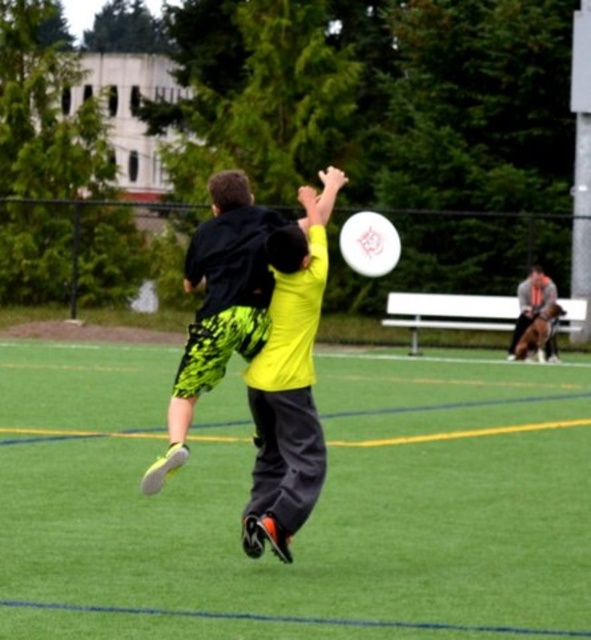
You are a photographer standing at the center of the field trying to capture the perfect shot of the two players in midair. You notice two points marked on your camera screen at coordinates point (368,241) and point (537,301). Which point is closer to your camera lens?

Point (537,301) is closer to the camera lens because the Objects Description states that point (368,241) is further to the camera than point (537,301).

You are a referee observing the game. You need to determine if the neon green shorts at center is closer to the white matte frisbee at center than the other player. Can you confirm this?

The neon green shorts at center is in front of the white matte frisbee at center, so yes, the neon green shorts at center is closer to the frisbee than the other player.

You are a referee watching the frisbee game. You see the neon yellow jersey at center and the white matte frisbee at center. Which one is closer to the left side of the field?

The neon yellow jersey at center is positioned on the left side of white matte frisbee at center, so it is closer to the left side of the field.